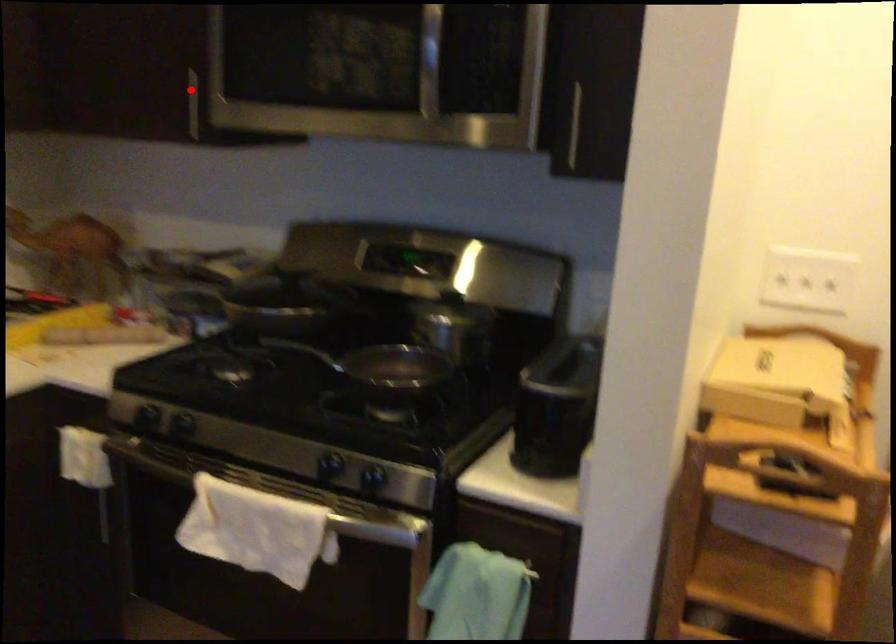
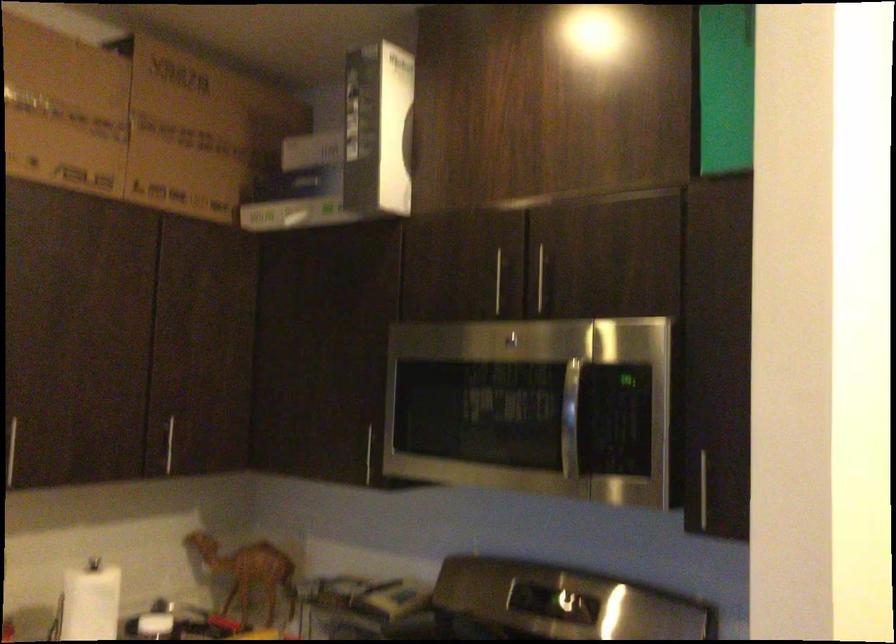
Question: I am providing you with two images of the same scene from different viewpoints. A red point is shown in image1. For the corresponding object point in image2, is it positioned nearer or farther from the camera?

Choices:
 (A) Nearer
 (B) Farther

Answer: (B)